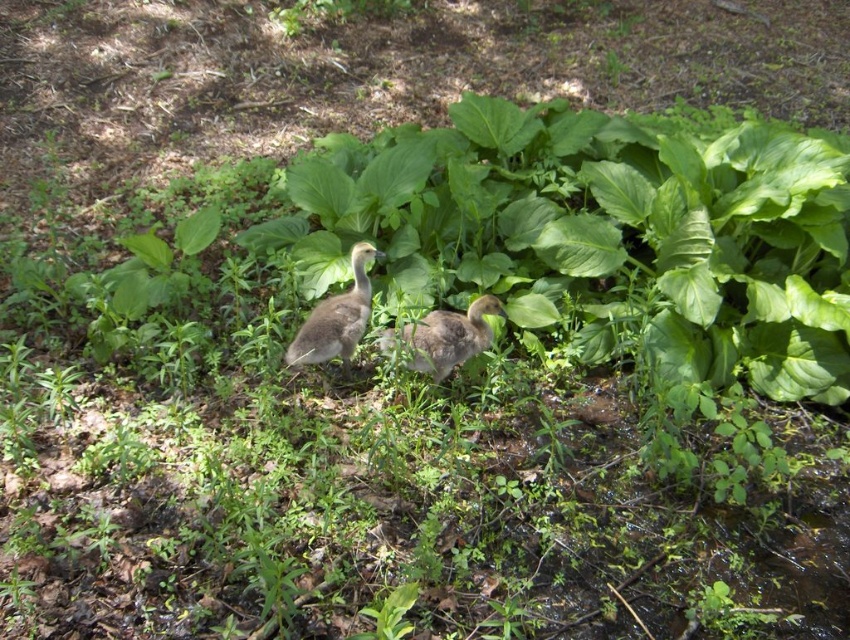
Does gray downy duckling at center appear under brown downy duckling at center?

Actually, gray downy duckling at center is above brown downy duckling at center.

The image size is (850, 640). What do you see at coordinates (336, 317) in the screenshot?
I see `gray downy duckling at center` at bounding box center [336, 317].

Where is `gray downy duckling at center`? gray downy duckling at center is located at coordinates (336, 317).